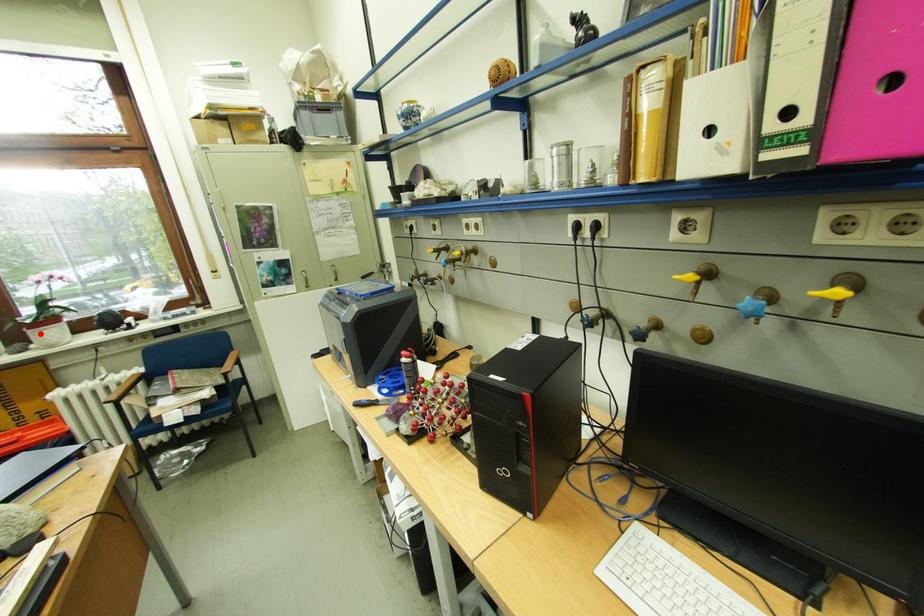
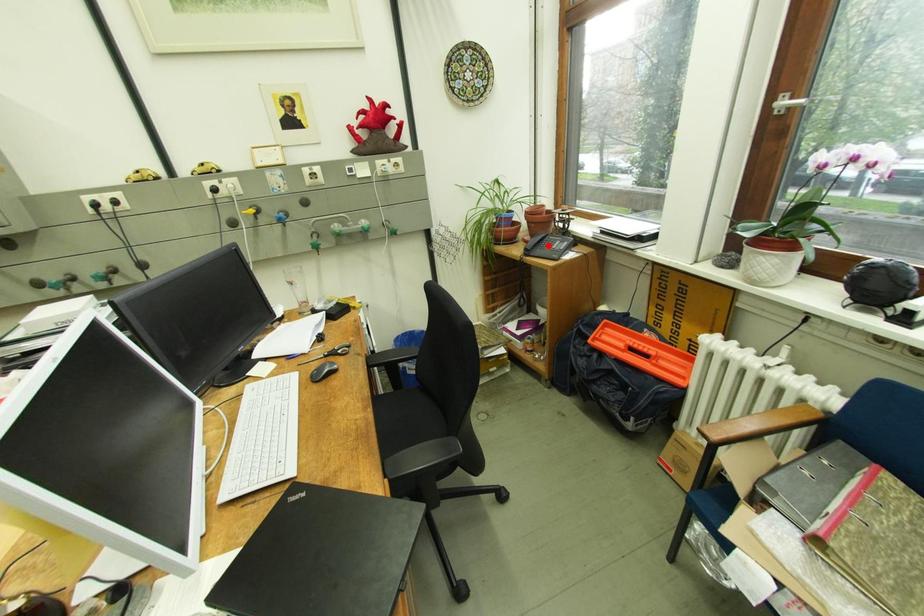
I am providing you with two images of the same scene from different viewpoints. A red point is marked on the first image and another point is marked on the second image. Is the marked point in image1 the same physical position as the marked point in image2?

No